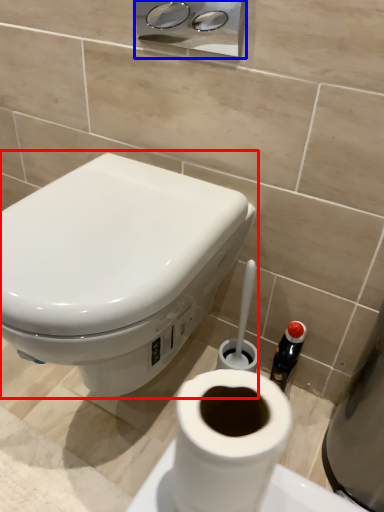
Question: Which point is further to the camera, toilet (highlighted by a red box) or dispenser (highlighted by a blue box)?

Choices:
 (A) toilet
 (B) dispenser

Answer: (B)